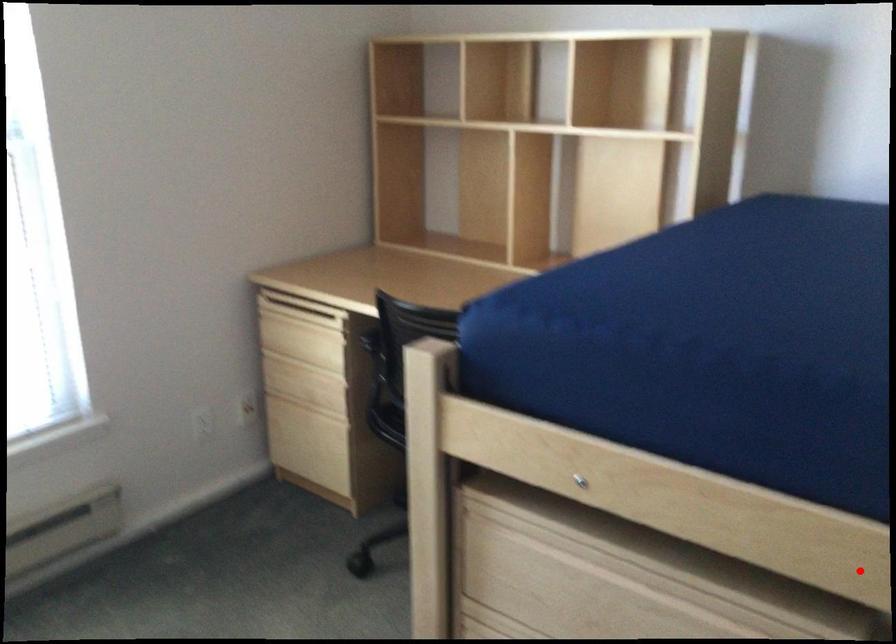
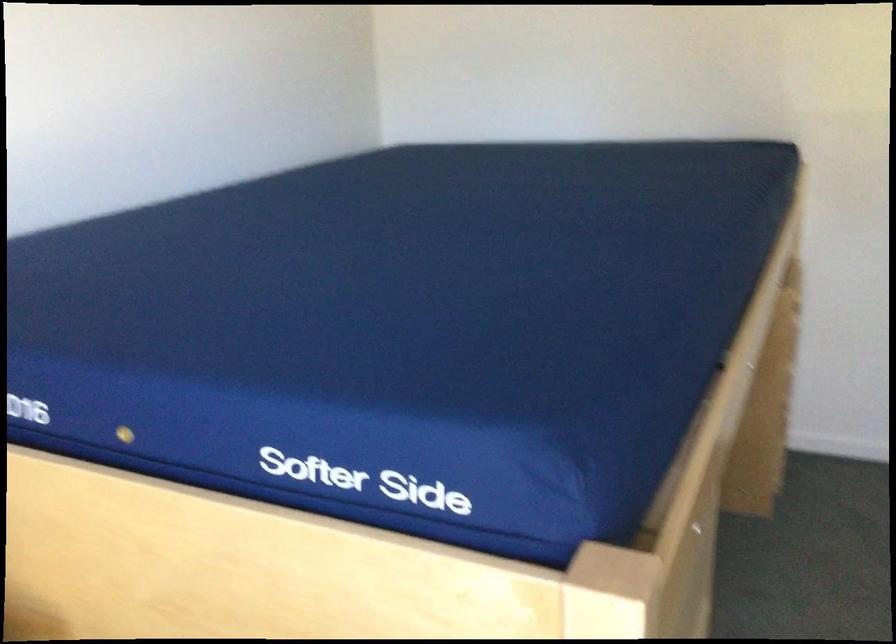
Question: I am providing you with two images of the same scene from different viewpoints. A red point is marked on the first image. Is the red point's position out of view in image 2?

Choices:
 (A) Yes
 (B) No

Answer: (A)